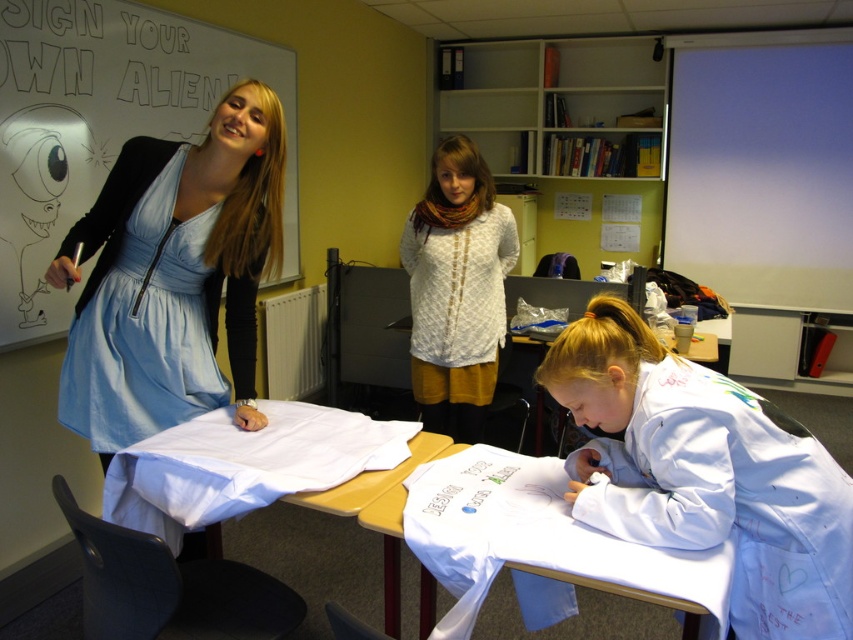
Question: Can you confirm if whiteboard at upper left is positioned to the left of white fabric at center?

Choices:
 (A) no
 (B) yes

Answer: (B)

Question: Does white fabric at center come behind white lace sweater at center?

Choices:
 (A) no
 (B) yes

Answer: (A)

Question: Is white paper at lower center smaller than white fabric at center?

Choices:
 (A) yes
 (B) no

Answer: (A)

Question: Based on their relative distances, which object is farther from the white fabric at center?

Choices:
 (A) matte blue dress at upper left
 (B) white matte lab coat at lower right

Answer: (B)

Question: Among these objects, which one is nearest to the camera?

Choices:
 (A) whiteboard at upper left
 (B) white lace sweater at center
 (C) matte blue dress at upper left
 (D) white matte lab coat at lower right

Answer: (D)

Question: Among these points, which one is nearest to the camera?

Choices:
 (A) (131, 304)
 (B) (428, 417)

Answer: (A)